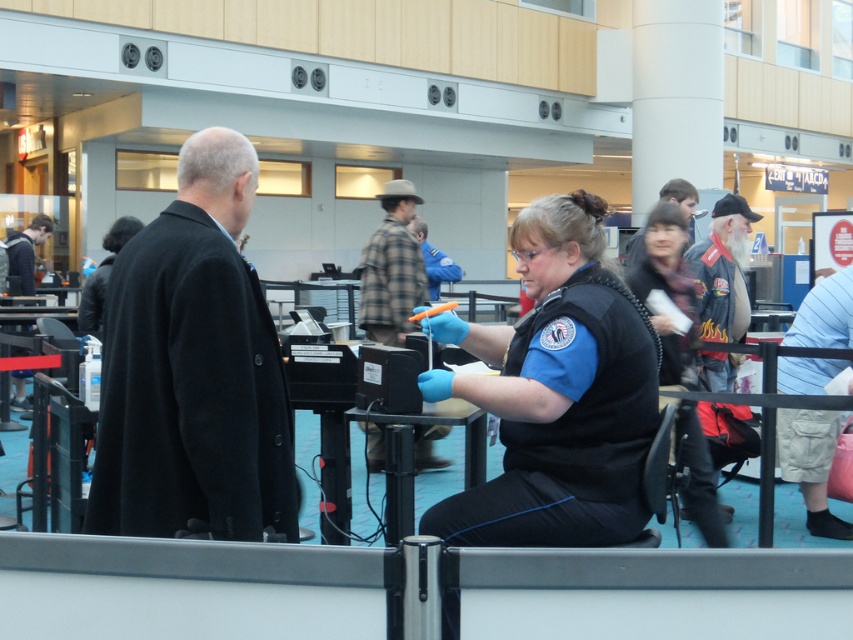
Question: Among these objects, which one is nearest to the camera?

Choices:
 (A) plaid fabric shirt at center
 (B) leather jacket at right

Answer: (B)

Question: Can you confirm if leather jacket at right is positioned to the right of dark blue jacket at left?

Choices:
 (A) yes
 (B) no

Answer: (A)

Question: Which point is farther from the camera taking this photo?

Choices:
 (A) (782, 410)
 (B) (212, 422)
 (C) (36, 234)
 (D) (674, 202)

Answer: (C)

Question: Is plaid fabric shirt at center below dark brown leather jacket at upper center?

Choices:
 (A) yes
 (B) no

Answer: (A)

Question: From the image, what is the correct spatial relationship of black wool coat at left in relation to dark brown leather jacket at upper center?

Choices:
 (A) right
 (B) left

Answer: (B)

Question: Which of the following is the farthest from the observer?

Choices:
 (A) dark blue jacket at left
 (B) dark brown leather jacket at upper center

Answer: (A)